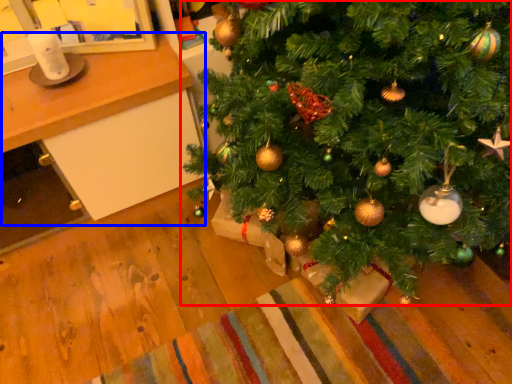
Question: Which of the following is the closest to the observer, christmas tree (highlighted by a red box) or table (highlighted by a blue box)?

Choices:
 (A) christmas tree
 (B) table

Answer: (A)